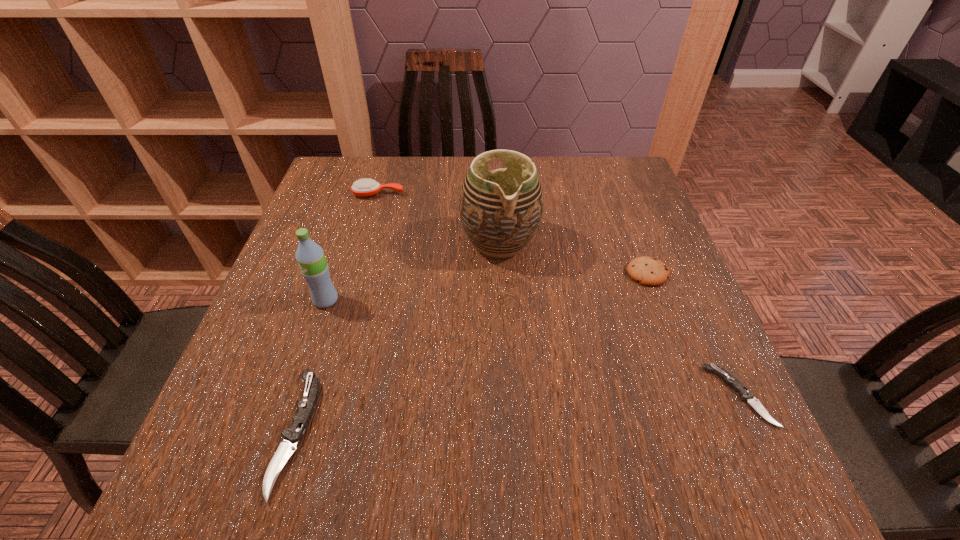
Identify which object is located as the second nearest to the water bottle. Please provide its 2D coordinates. Your answer should be formatted as a tuple, i.e. [(x, y)], where the tuple contains the x and y coordinates of a point satisfying the conditions above.

[(500, 210)]

Locate an element on the screen. Image resolution: width=960 pixels, height=540 pixels. blank area in the image that satisfies the following two spatial constraints: 1. on the back side of the second shortest object; 2. on the right side of the fourth object from left to right is located at coordinates (354, 242).

This screenshot has height=540, width=960. What are the coordinates of `blank area in the image that satisfies the following two spatial constraints: 1. on the back side of the fifth tallest object; 2. on the left side of the shorter pocketknife` in the screenshot? It's located at (306, 396).